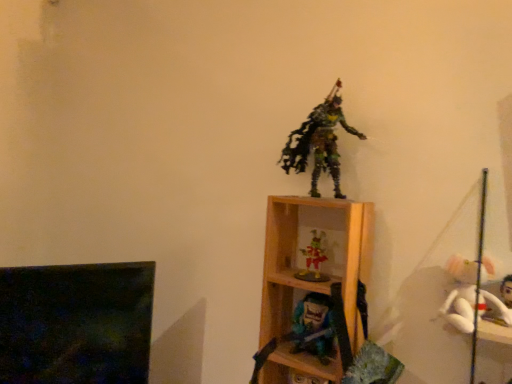
Question: Is matte blue plastic toy at center, marked as the 4th toy in a top-to-bottom arrangement, positioned before white plush at right, which is the second toy from bottom to top?

Choices:
 (A) yes
 (B) no

Answer: (B)

Question: From a real-world perspective, does matte blue plastic toy at center, which is the first toy in bottom-to-top order, stand above white plush at right, which is the third toy from top to bottom?

Choices:
 (A) no
 (B) yes

Answer: (A)

Question: Is there a large distance between matte blue plastic toy at center, which is the first toy in bottom-to-top order, and white plush at right, which is the third toy from top to bottom?

Choices:
 (A) yes
 (B) no

Answer: (B)

Question: Does matte blue plastic toy at center, which is the first toy in bottom-to-top order, have a smaller size compared to white plush at right, which is the second toy from bottom to top?

Choices:
 (A) yes
 (B) no

Answer: (A)

Question: From the image's perspective, is matte blue plastic toy at center, which is the first toy in bottom-to-top order, located beneath white plush at right, which is the second toy from bottom to top?

Choices:
 (A) yes
 (B) no

Answer: (A)

Question: Considering the positions of white plush at right, which is the third toy from top to bottom, and wooden shelf at center in the image, is white plush at right, which is the third toy from top to bottom, wider or thinner than wooden shelf at center?

Choices:
 (A) wide
 (B) thin

Answer: (B)

Question: In terms of height, does white plush at right, which is the third toy from top to bottom, look taller or shorter compared to wooden shelf at center?

Choices:
 (A) short
 (B) tall

Answer: (A)

Question: Looking at the image, does white plush at right, which is the second toy from bottom to top, seem bigger or smaller compared to wooden shelf at center?

Choices:
 (A) big
 (B) small

Answer: (B)

Question: Is white plush at right, which is the second toy from bottom to top, inside the boundaries of wooden shelf at center, or outside?

Choices:
 (A) outside
 (B) inside

Answer: (A)

Question: Is wooden shelf at center in front of or behind shiny plastic figurine at center, the third toy from the bottom, in the image?

Choices:
 (A) front
 (B) behind

Answer: (A)

Question: From the image's perspective, is wooden shelf at center positioned above or below shiny plastic figurine at center, the 2th toy positioned from the top?

Choices:
 (A) below
 (B) above

Answer: (A)

Question: Which is correct: wooden shelf at center is inside shiny plastic figurine at center, the 2th toy positioned from the top, or outside of it?

Choices:
 (A) inside
 (B) outside

Answer: (B)

Question: Considering the positions of wooden shelf at center and shiny plastic figurine at center, the 2th toy positioned from the top, in the image, is wooden shelf at center wider or thinner than shiny plastic figurine at center, the 2th toy positioned from the top,?

Choices:
 (A) wide
 (B) thin

Answer: (A)

Question: Is matte blue plastic toy at center, which is the first toy in bottom-to-top order, to the left or to the right of multicolored plastic figure at center, which is the first toy in top-to-bottom order, in the image?

Choices:
 (A) left
 (B) right

Answer: (B)

Question: Is point (305, 336) positioned closer to the camera than point (331, 107)?

Choices:
 (A) farther
 (B) closer

Answer: (A)